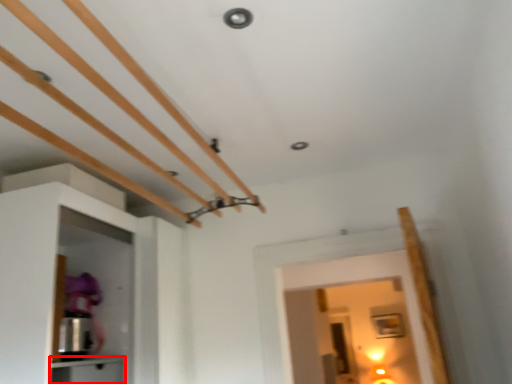
Question: From the image's perspective, considering the relative positions of cabinetry (annotated by the red box) and cabinetry in the image provided, where is cabinetry (annotated by the red box) located with respect to the staircase?

Choices:
 (A) above
 (B) below

Answer: (B)